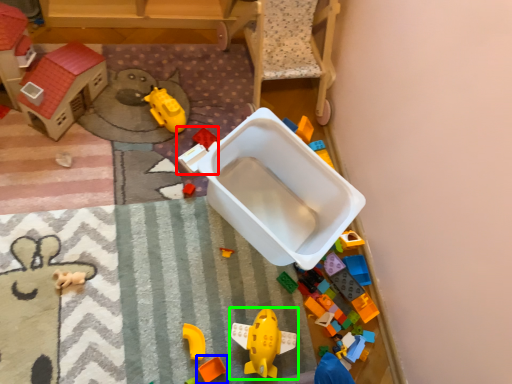
Question: Which object is the farthest from toy (highlighted by a red box)? Choose among these: toy (highlighted by a blue box) or toy (highlighted by a green box).

Choices:
 (A) toy
 (B) toy

Answer: (A)